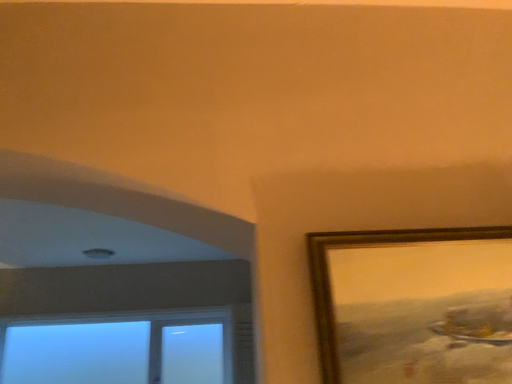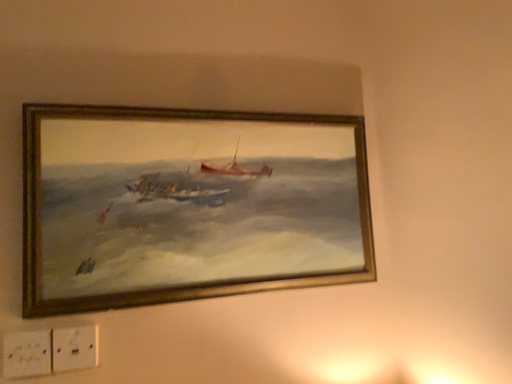
Question: How did the camera likely rotate when shooting the video?

Choices:
 (A) rotated upward
 (B) rotated downward

Answer: (B)